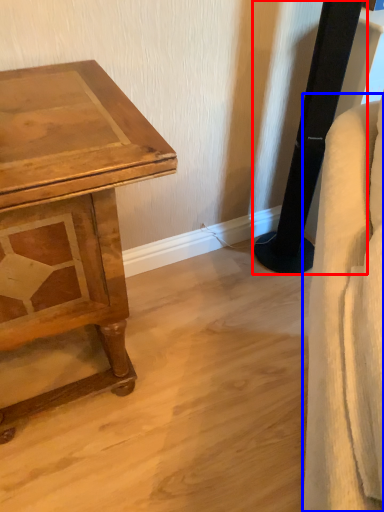
Question: Among these objects, which one is nearest to the camera, pillar (highlighted by a red box) or swivel chair (highlighted by a blue box)?

Choices:
 (A) pillar
 (B) swivel chair

Answer: (B)